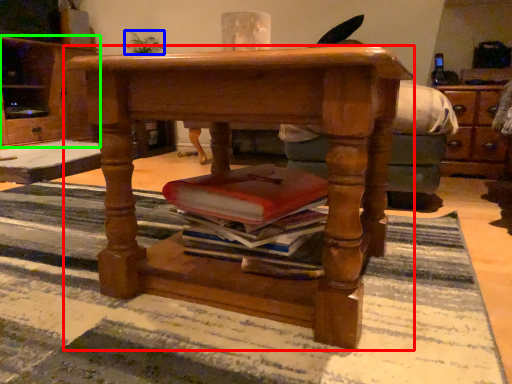
Question: Which object is positioned farthest from desk (highlighted by a red box)? Select from houseplant (highlighted by a blue box) and cabinetry (highlighted by a green box).

Choices:
 (A) houseplant
 (B) cabinetry

Answer: (A)